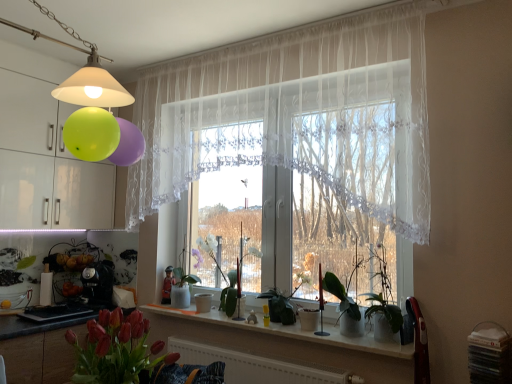
Question: From the image's perspective, relative to white lace curtain at center, is white glossy vase at center, which is counted as the 1th plant, starting from the back, above or below?

Choices:
 (A) below
 (B) above

Answer: (A)

Question: Considering the relative positions of white glossy vase at center, which is counted as the 1th plant, starting from the back, and white lace curtain at center in the image provided, is white glossy vase at center, which is counted as the 1th plant, starting from the back, to the left or to the right of white lace curtain at center?

Choices:
 (A) right
 (B) left

Answer: (B)

Question: Based on their relative distances, which object is farther from the matte white lampshade at upper left?

Choices:
 (A) white matte radiator at lower center
 (B) white lace curtain at center
 (C) green matte plant at center, marked as the 2th plant in a left-to-right arrangement
 (D) white glossy window sill at center
 (E) white glossy vase at center, which is counted as the 1th plant, starting from the back

Answer: (C)

Question: Which object is positioned farthest from the green matte plant at center, placed as the 1th plant when sorted from right to left?

Choices:
 (A) white matte radiator at lower center
 (B) white sheer curtain at center
 (C) white glossy window sill at center
 (D) white glossy vase at center, the 1th plant when ordered from left to right
 (E) white lace curtain at center

Answer: (D)